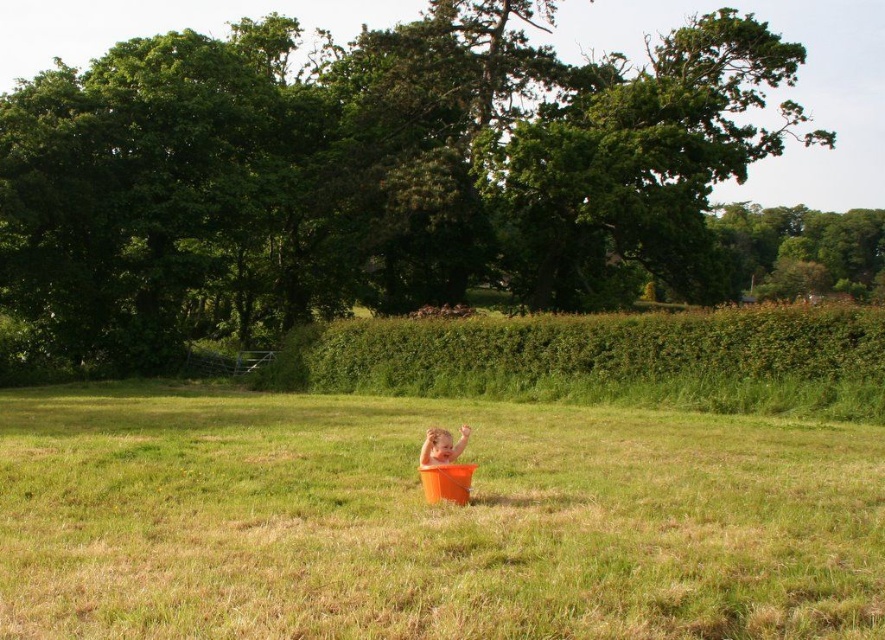
You are a gardener who needs to water the green leafy hedge at center. The orange matte bucket at center is in the way. Can you move the bucket to the side to access the hedge?

The orange matte bucket at center is located below the green leafy hedge at center, so you can move the bucket to the side to access the hedge.

You are a parent trying to choose between two buckets for your child to sit in. The orange matte bucket at center and the smooth orange bucket at center are both available. Which bucket should you choose if you want the one that can hold more weight?

The orange matte bucket at center has a larger size compared to the smooth orange bucket at center, so it can hold more weight.